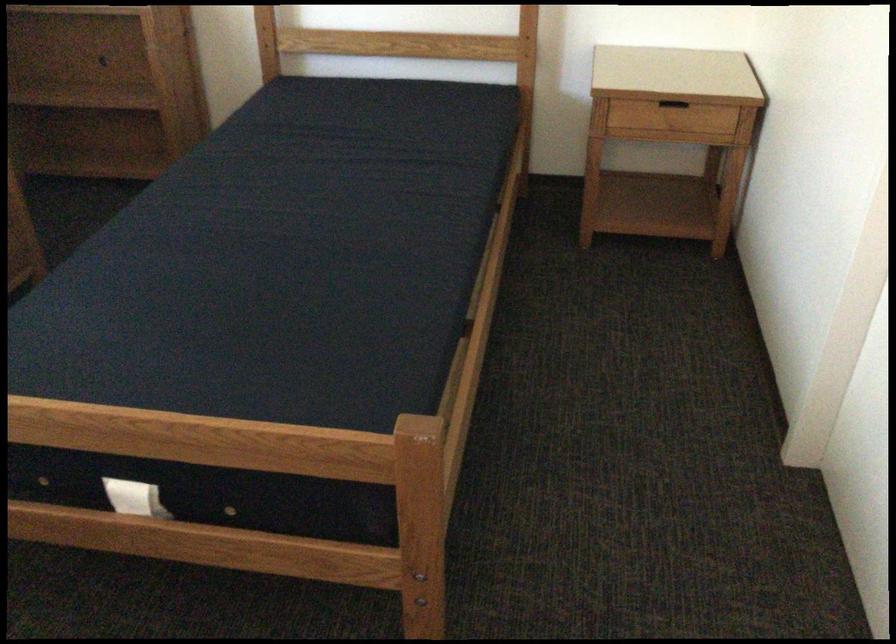
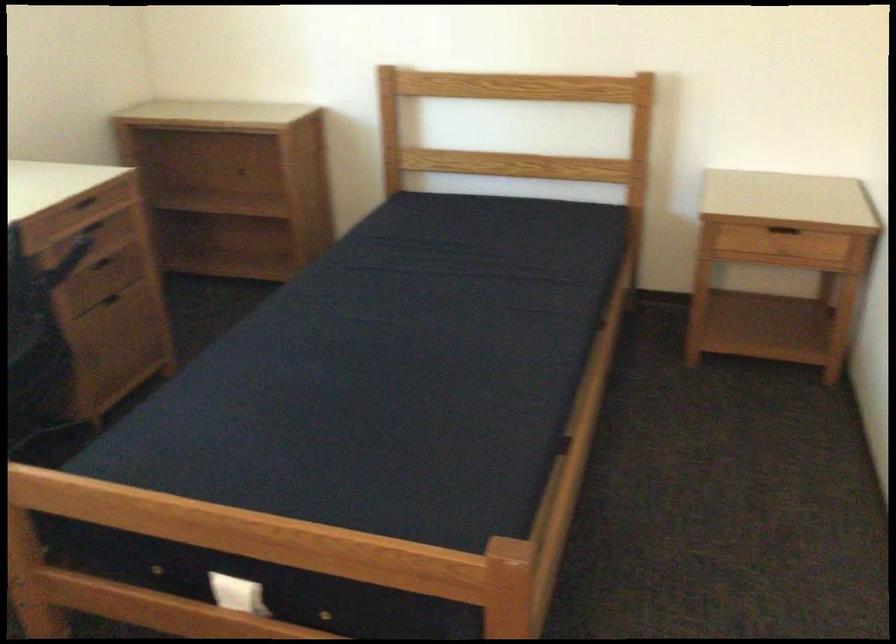
Question: The camera is either moving clockwise (left) or counter-clockwise (right) around the object. The first image is from the beginning of the video and the second image is from the end. Is the camera moving left or right when shooting the video?

Choices:
 (A) Left
 (B) Right

Answer: (B)